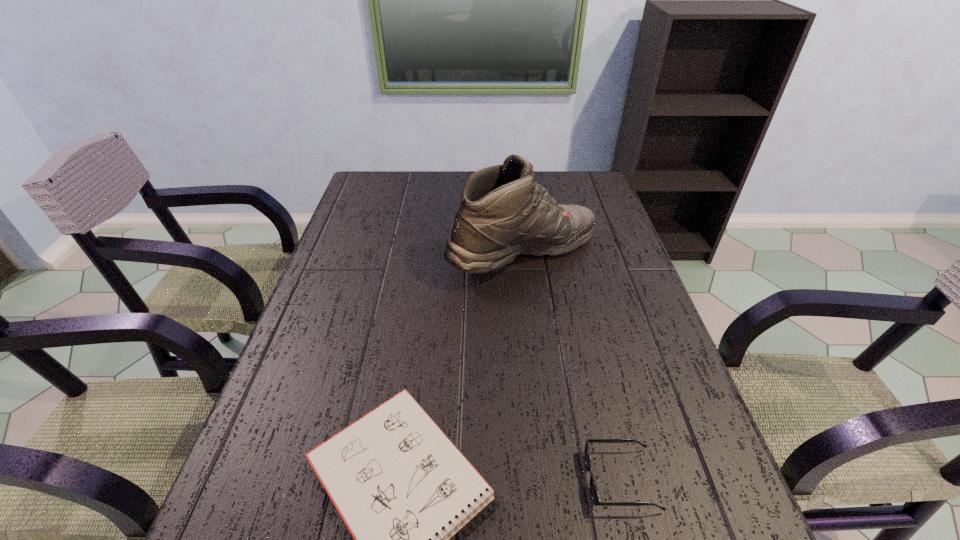
Find the location of a particular element. This screenshot has height=540, width=960. the farthest object is located at coordinates (503, 213).

The image size is (960, 540). I want to click on the tallest object, so click(503, 213).

Where is `sunglasses`? Image resolution: width=960 pixels, height=540 pixels. sunglasses is located at coordinates (593, 487).

Locate an element on the screen. The image size is (960, 540). vacant region located on the back of the ski boot is located at coordinates (516, 193).

The width and height of the screenshot is (960, 540). Find the location of `free location located 0.380m at the front lenses of the sunglasses`. free location located 0.380m at the front lenses of the sunglasses is located at coordinates (374, 480).

What are the coordinates of `vacant area situated at the front lenses of the sunglasses` in the screenshot? It's located at (442, 480).

Identify the location of vacant space positioned 0.250m at the front lenses of the sunglasses. This screenshot has height=540, width=960. (447, 480).

This screenshot has width=960, height=540. What are the coordinates of `ski boot that is at the right edge` in the screenshot? It's located at (503, 213).

Where is `sunglasses that is at the right edge`? This screenshot has height=540, width=960. sunglasses that is at the right edge is located at coordinates (593, 487).

The height and width of the screenshot is (540, 960). I want to click on blank space at the left edge of the desktop, so pos(268,454).